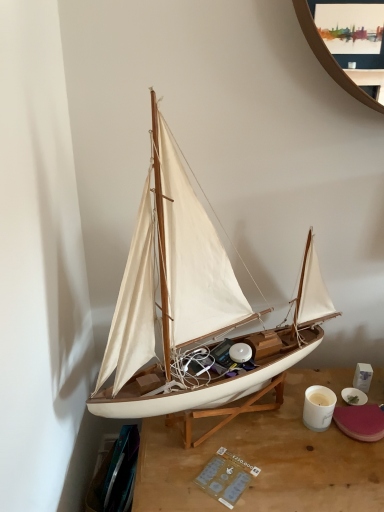
Locate an element on the screen. free space below white matte sailboat at center (from a real-world perspective) is located at coordinates (248, 421).